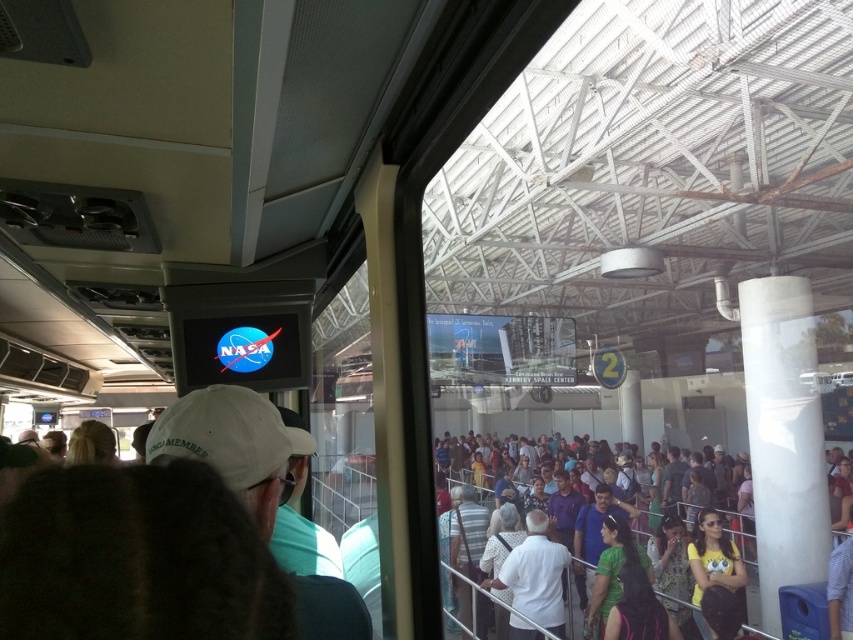
Question: Can you confirm if dark gray shirt at center is bigger than multicolored casual attire at center?

Choices:
 (A) no
 (B) yes

Answer: (A)

Question: Estimate the real-world distances between objects in this image. Which object is farther from the dark gray shirt at center?

Choices:
 (A) multicolored casual attire at center
 (B) white matte shirt at center
 (C) light brown leather jacket at center
 (D) white fabric cap at center

Answer: (D)

Question: Which of these objects is positioned closest to the white fabric cap at center?

Choices:
 (A) dark gray shirt at center
 (B) multicolored casual attire at center
 (C) light brown leather jacket at center
 (D) white matte shirt at center

Answer: (B)

Question: From the image, what is the correct spatial relationship of white matte shirt at center in relation to light brown leather jacket at center?

Choices:
 (A) below
 (B) above

Answer: (B)

Question: Is light brown leather jacket at center to the left of multicolored casual attire at center from the viewer's perspective?

Choices:
 (A) no
 (B) yes

Answer: (B)

Question: Which point is farther to the camera?

Choices:
 (A) multicolored casual attire at center
 (B) white matte shirt at center
 (C) light brown leather jacket at center
 (D) white fabric cap at center

Answer: (C)